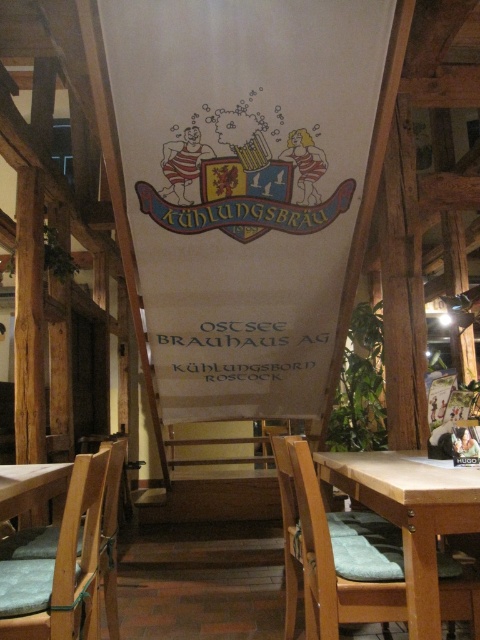
Based on the photo, can you confirm if wooden chair at center is shorter than wooden chair at lower left?

Incorrect, wooden chair at center's height does not fall short of wooden chair at lower left's.

Is wooden chair at center below wooden chair at lower left?

Yes, wooden chair at center is below wooden chair at lower left.

Is point (372, 616) closer to camera compared to point (94, 632)?

Yes, it is.

Identify the location of wooden chair at center. The height and width of the screenshot is (640, 480). [x=334, y=554].